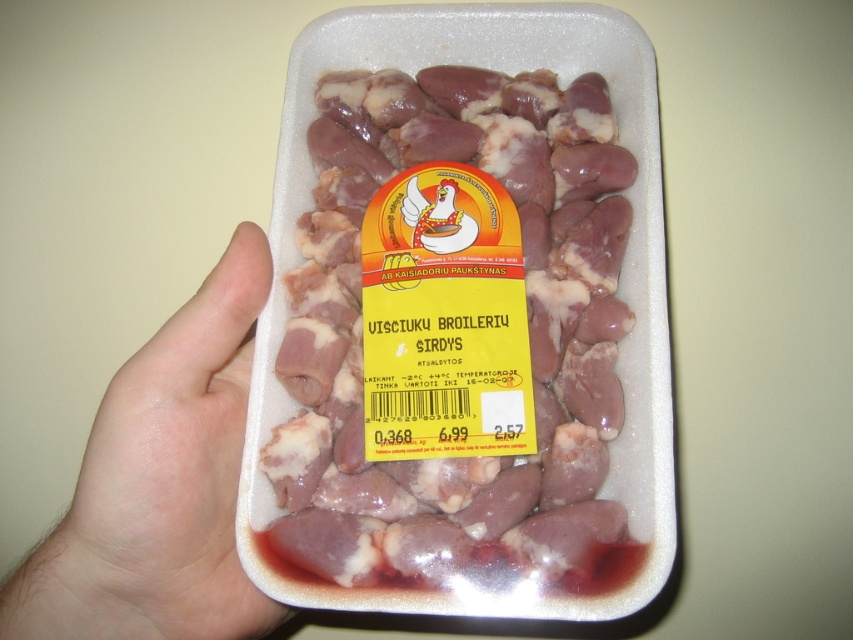
Can you confirm if pinkish raw meat at center is positioned below pale skin at center?

No, pinkish raw meat at center is not below pale skin at center.

Does pinkish raw meat at center have a smaller size compared to pale skin at center?

→ No.

Locate an element on the screen. pinkish raw meat at center is located at coordinates (527, 326).